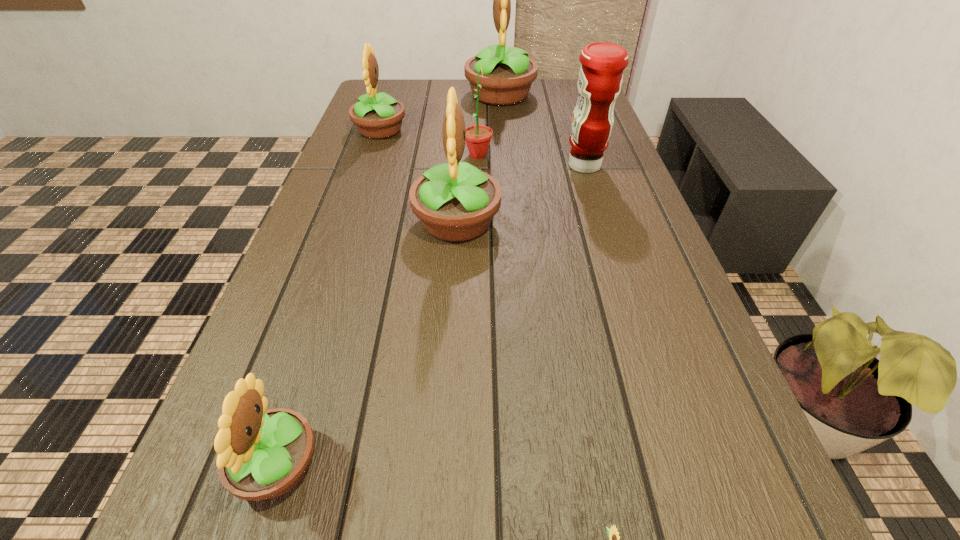
Where is `object that can be found as the third closest to the fifth farthest sunflower`? Image resolution: width=960 pixels, height=540 pixels. object that can be found as the third closest to the fifth farthest sunflower is located at coordinates (478, 137).

Identify the location of object that can be found as the closest to the third smallest yellow sunflower. The width and height of the screenshot is (960, 540). (478, 137).

The width and height of the screenshot is (960, 540). I want to click on the second closest sunflower to the nearest yellow sunflower, so click(455, 202).

Choose which sunflower is the fifth nearest neighbor to the rightmost object. Please provide its 2D coordinates. Your answer should be formatted as a tuple, i.e. [(x, y)], where the tuple contains the x and y coordinates of a point satisfying the conditions above.

[(262, 454)]

Identify which yellow sunflower is the fourth closest to the rightmost object. Please provide its 2D coordinates. Your answer should be formatted as a tuple, i.e. [(x, y)], where the tuple contains the x and y coordinates of a point satisfying the conditions above.

[(262, 454)]

Identify which yellow sunflower is located as the nearest to the right green sunflower. Please provide its 2D coordinates. Your answer should be formatted as a tuple, i.e. [(x, y)], where the tuple contains the x and y coordinates of a point satisfying the conditions above.

[(262, 454)]